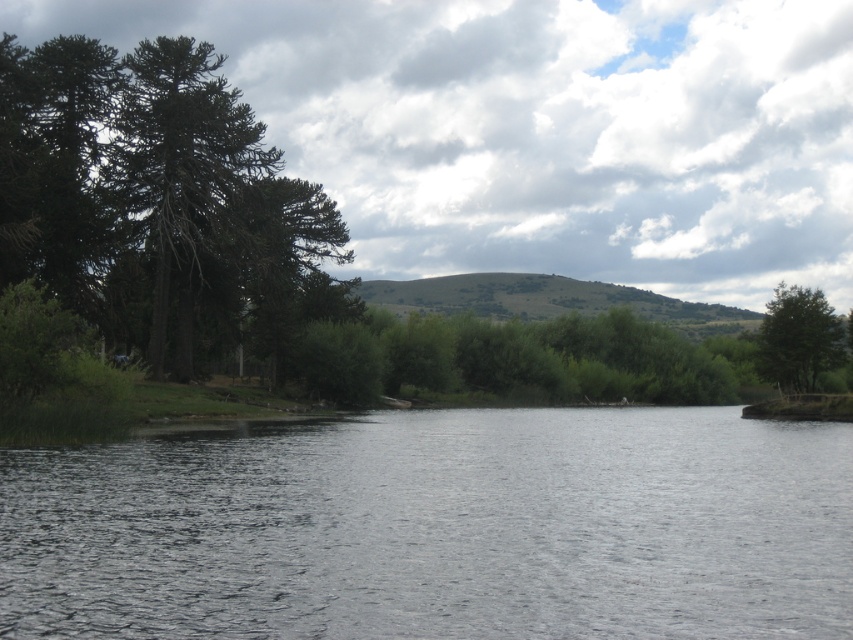
Does clear water at center have a lesser height compared to green rough bark tree at left?

Indeed, clear water at center has a lesser height compared to green rough bark tree at left.

Does clear water at center appear over green rough bark tree at left?

No.

Does point (846, 440) come farther from viewer compared to point (183, 324)?

No, it is in front of (183, 324).

The height and width of the screenshot is (640, 853). Find the location of `clear water at center`. clear water at center is located at coordinates (437, 529).

Consider the image. Who is taller, clear water at center or green leafy tree at right?

green leafy tree at right

Can you confirm if clear water at center is positioned below green leafy tree at right?

Indeed, clear water at center is positioned under green leafy tree at right.

Locate an element on the screen. clear water at center is located at coordinates (437, 529).

Between green rough bark tree at left and green leafy tree at right, which one is positioned lower?

green leafy tree at right is lower down.

Who is positioned more to the right, green rough bark tree at left or green leafy tree at right?

Positioned to the right is green leafy tree at right.

Is point (177, 193) positioned before point (798, 364)?

That is False.

You are a GUI agent. You are given a task and a screenshot of the screen. Output one action in this format:
    pyautogui.click(x=<x>, y=<y>)
    Task: Click on the green rough bark tree at left
    The height and width of the screenshot is (640, 853).
    Given the screenshot: What is the action you would take?
    pyautogui.click(x=181, y=177)